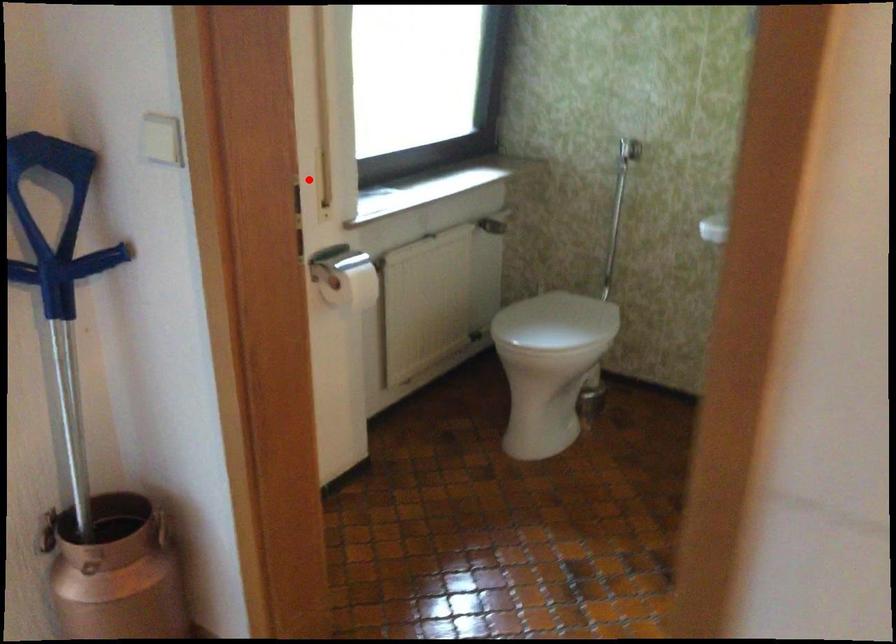
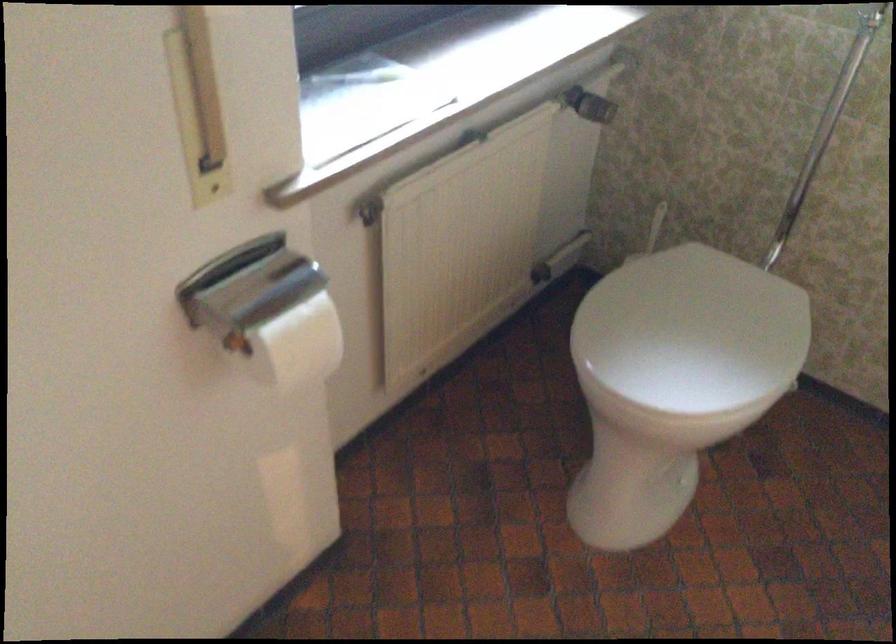
Question: I am providing you with two images of the same scene from different viewpoints. Given a red point in image1, look at the same physical point in image2. Is it:

Choices:
 (A) Closer to the viewpoint
 (B) Farther from the viewpoint

Answer: (A)